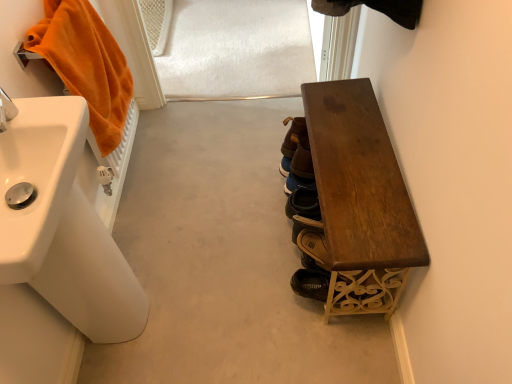
You are a GUI agent. You are given a task and a screenshot of the screen. Output one action in this format:
    pyautogui.click(x=<x>, y=<y>)
    Task: Click on the vacant space to the right of brushed metal faucet at upper left
    
    Given the screenshot: What is the action you would take?
    pyautogui.click(x=48, y=109)